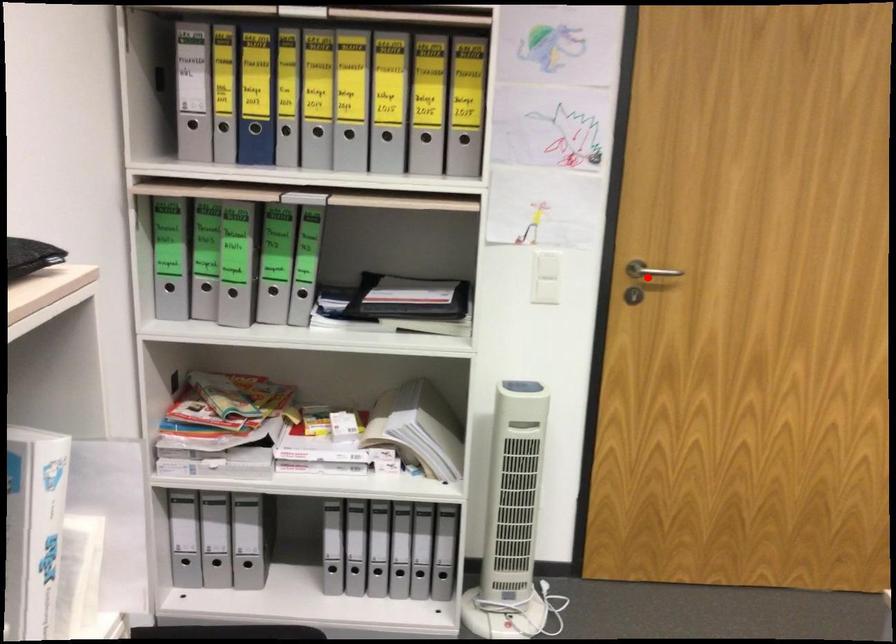
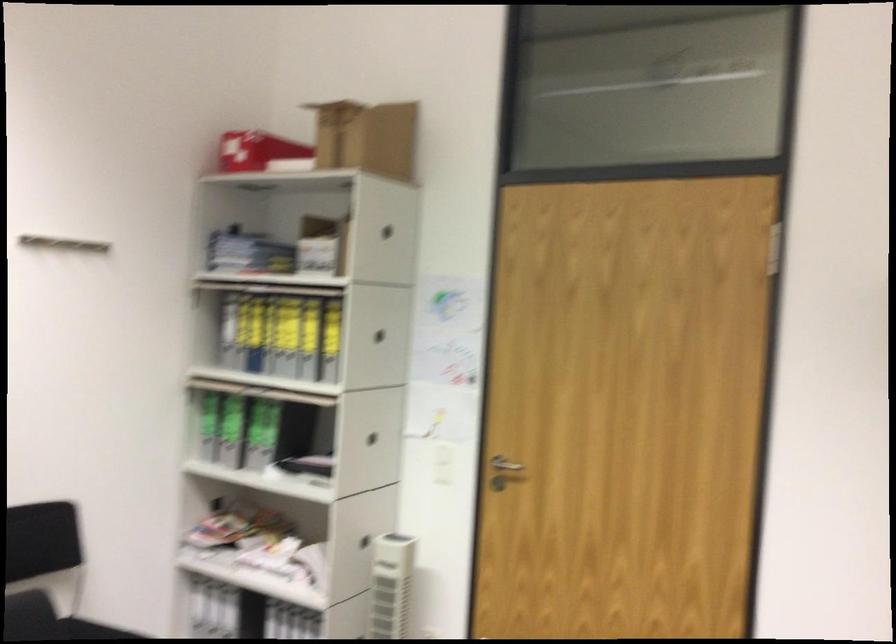
Question: I am providing you with two images of the same scene from different viewpoints. In image1, a red point is highlighted. Considering the same 3D point in image2, which of the following is correct?

Choices:
 (A) It is closer
 (B) It is farther

Answer: (B)